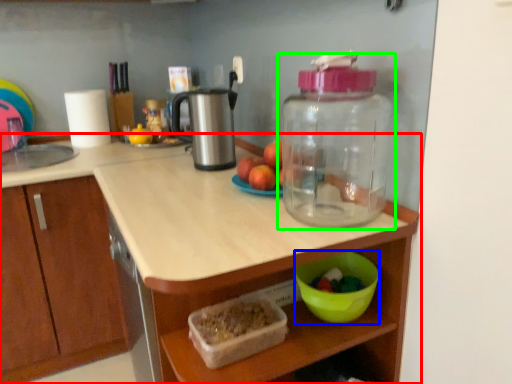
Question: Estimate the real-world distances between objects in this image. Which object is farther from countertop (highlighted by a red box), bowl (highlighted by a blue box) or bottle (highlighted by a green box)?

Choices:
 (A) bowl
 (B) bottle

Answer: (A)